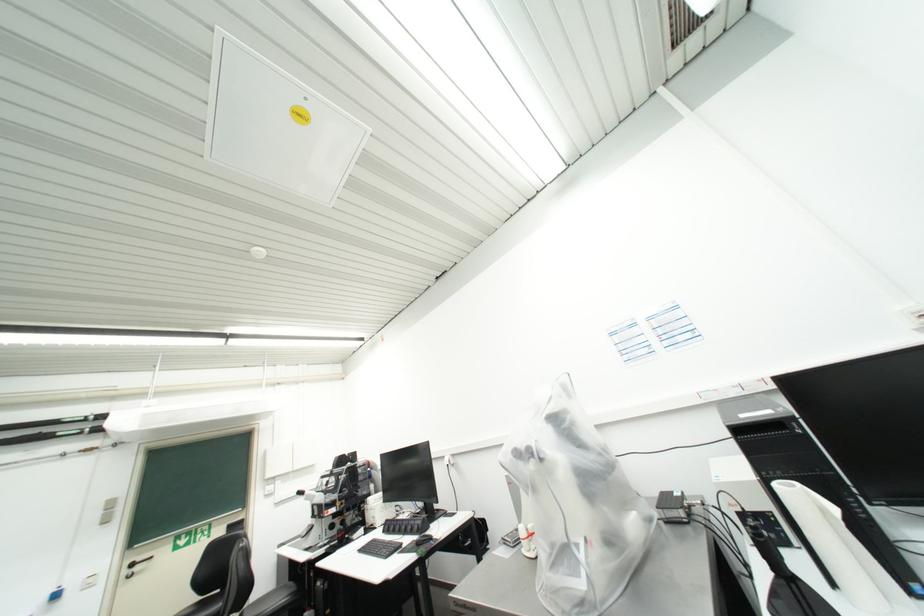
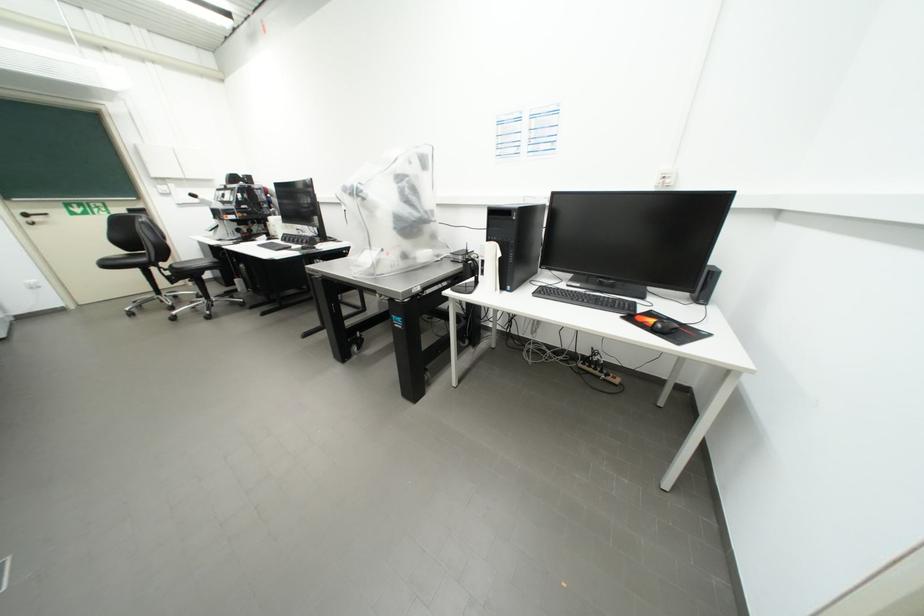
In the second image, find the point that corresponds to the point at 146,569 in the first image.

(43, 220)